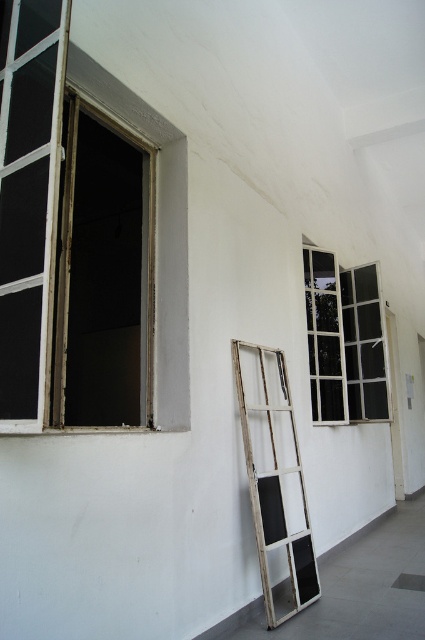
You are standing in the room and want to reach the white glass window at center to clean it. The white wooden ladder at center is available. Can you use the ladder to reach the window?

The white wooden ladder at center is below the white glass window at center, so yes, you can use the ladder to reach the window since it is positioned under it.

You are standing in the corner of the room and want to move from point A to point B. Point A is at coordinate [278,490] and point B is at coordinate [320,401]. Which point is closer to you?

Point A at coordinate [278,490] is closer to you because it is in front of point B at coordinate [320,401].